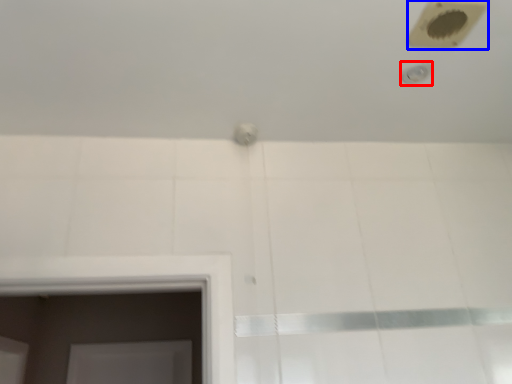
Question: Which of the following is the farthest to the observer, shower (highlighted by a red box) or hole (highlighted by a blue box)?

Choices:
 (A) shower
 (B) hole

Answer: (A)